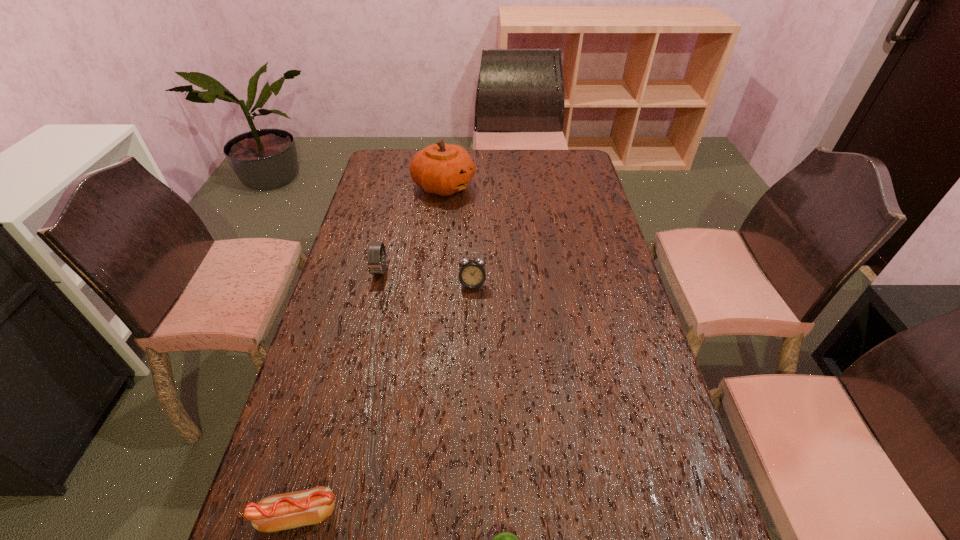
Locate an element on the screen. The width and height of the screenshot is (960, 540). the farthest object is located at coordinates (442, 169).

The width and height of the screenshot is (960, 540). Find the location of `pumpkin`. pumpkin is located at coordinates pyautogui.click(x=442, y=169).

You are a GUI agent. You are given a task and a screenshot of the screen. Output one action in this format:
    pyautogui.click(x=<x>, y=<y>)
    Task: Click on the alarm clock
    The width and height of the screenshot is (960, 540).
    Given the screenshot: What is the action you would take?
    pyautogui.click(x=472, y=274)

Where is `watch`? This screenshot has height=540, width=960. watch is located at coordinates (375, 262).

At what (x,y) coordinates should I click in order to perform the action: click on the fourth farthest object. Please return your answer as a coordinate pair (x, y). Looking at the image, I should click on (278, 512).

Locate an element on the screen. sausage is located at coordinates (278, 512).

Locate an element on the screen. blank space located 0.240m on the front-facing side of the pumpkin is located at coordinates (536, 186).

Where is `vacant region located 0.380m on the face of the alarm clock`? vacant region located 0.380m on the face of the alarm clock is located at coordinates click(470, 406).

The width and height of the screenshot is (960, 540). I want to click on vacant area situated on the face of the watch, so click(x=364, y=341).

You are a GUI agent. You are given a task and a screenshot of the screen. Output one action in this format:
    pyautogui.click(x=<x>, y=<y>)
    Task: Click on the vacant space located on the back of the shortest object
    The width and height of the screenshot is (960, 540).
    Given the screenshot: What is the action you would take?
    [x=319, y=439]